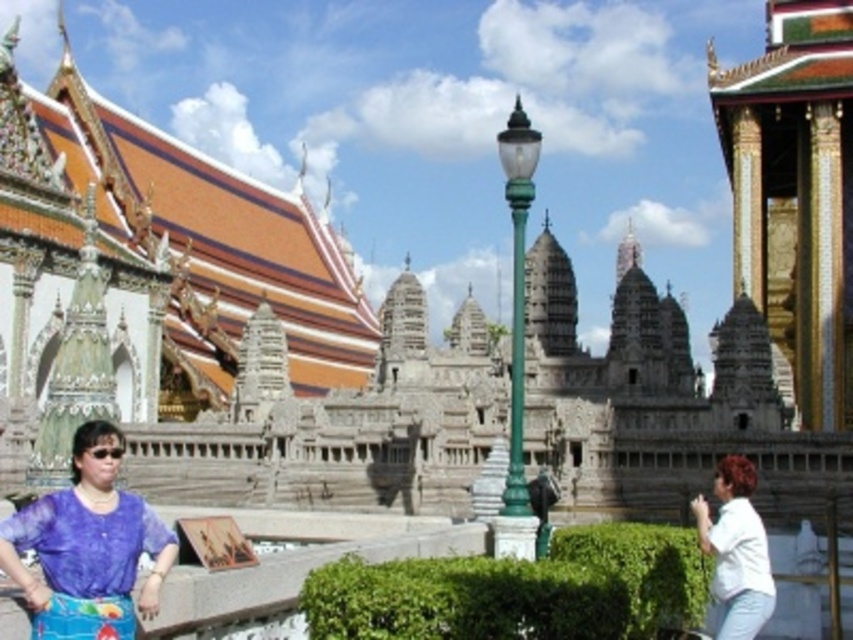
Question: Considering the relative positions of purple sheer blouse at lower left and white matte shirt at lower right in the image provided, where is purple sheer blouse at lower left located with respect to white matte shirt at lower right?

Choices:
 (A) below
 (B) above

Answer: (B)

Question: Is purple sheer blouse at lower left positioned before white matte shirt at lower right?

Choices:
 (A) yes
 (B) no

Answer: (A)

Question: Among these objects, which one is nearest to the camera?

Choices:
 (A) purple sheer blouse at lower left
 (B) white matte shirt at lower right

Answer: (A)

Question: Which of the following is the closest to the observer?

Choices:
 (A) purple sheer blouse at lower left
 (B) white matte shirt at lower right

Answer: (A)

Question: Observing the image, what is the correct spatial positioning of purple sheer blouse at lower left in reference to white matte shirt at lower right?

Choices:
 (A) above
 (B) below

Answer: (A)